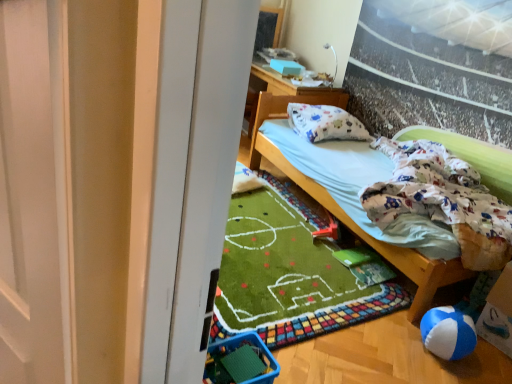
Find the location of a particular element. This screenshot has width=512, height=384. blue sponge ball at lower right is located at coordinates (448, 333).

This screenshot has height=384, width=512. Find the location of `blue plastic baby carriage at lower left`. blue plastic baby carriage at lower left is located at coordinates (240, 361).

Measure the distance between point (238, 349) and camera.

Point (238, 349) is 1.62 meters away from camera.

The width and height of the screenshot is (512, 384). Describe the element at coordinates (325, 123) in the screenshot. I see `white cotton pillow at upper center` at that location.

The height and width of the screenshot is (384, 512). What do you see at coordinates (328, 230) in the screenshot?
I see `red plastic toy at lower center` at bounding box center [328, 230].

Identify the location of white fabric pillow at upper center. The height and width of the screenshot is (384, 512). [286, 96].

Consider the image. Would you consider blue sponge ball at lower right to be distant from blue plastic baby carriage at lower left?

No, blue sponge ball at lower right is not far from blue plastic baby carriage at lower left.

Which is behind, blue sponge ball at lower right or blue plastic baby carriage at lower left?

blue sponge ball at lower right is more distant.

Considering the sizes of objects blue sponge ball at lower right and blue plastic baby carriage at lower left in the image provided, who is wider, blue sponge ball at lower right or blue plastic baby carriage at lower left?

With larger width is blue plastic baby carriage at lower left.

Does blue plastic baby carriage at lower left have a greater height compared to white cotton pillow at upper center?

No.

Image resolution: width=512 pixels, height=384 pixels. Identify the location of baby carriage that is in front of the white cotton pillow at upper center. (240, 361).

Who is smaller, blue plastic baby carriage at lower left or white cotton pillow at upper center?

blue plastic baby carriage at lower left.

How distant is white cotton pillow at upper center from blue plastic baby carriage at lower left?

The distance of white cotton pillow at upper center from blue plastic baby carriage at lower left is 6.08 feet.

Is white cotton pillow at upper center turned away from blue plastic baby carriage at lower left?

white cotton pillow at upper center is not turned away from blue plastic baby carriage at lower left.

Is white cotton pillow at upper center behind blue plastic baby carriage at lower left?

Yes, the depth of white cotton pillow at upper center is greater than that of blue plastic baby carriage at lower left.

Is white cotton pillow at upper center to the left or to the right of blue plastic baby carriage at lower left in the image?

Clearly, white cotton pillow at upper center is on the right of blue plastic baby carriage at lower left in the image.

From a real-world perspective, is white fabric pillow at upper center on top of blue sponge ball at lower right?

Yes, from a real-world perspective, white fabric pillow at upper center is over blue sponge ball at lower right

Is white fabric pillow at upper center not within blue sponge ball at lower right?

Yes, white fabric pillow at upper center is outside of blue sponge ball at lower right.

Between white fabric pillow at upper center and blue sponge ball at lower right, which one has more height?

white fabric pillow at upper center.

Considering the positions of objects white fabric pillow at upper center and blue sponge ball at lower right in the image provided, who is more to the left, white fabric pillow at upper center or blue sponge ball at lower right?

white fabric pillow at upper center.

Are blue sponge ball at lower right and white fabric pillow at upper center located far from each other?

Indeed, blue sponge ball at lower right is not near white fabric pillow at upper center.

From the image's perspective, is blue sponge ball at lower right on top of white fabric pillow at upper center?

No, from the image's perspective, blue sponge ball at lower right is not on top of white fabric pillow at upper center.

Does white cotton mattress at center have a greater height compared to blue sponge ball at lower right?

Correct, white cotton mattress at center is much taller as blue sponge ball at lower right.

Considering the positions of points (298, 149) and (432, 326), is point (298, 149) farther from camera compared to point (432, 326)?

Yes, point (298, 149) is farther from viewer.

Is white cotton mattress at center to the left of blue sponge ball at lower right from the viewer's perspective?

No.

Can you confirm if white cotton mattress at center is smaller than blue sponge ball at lower right?

No.

From the image's perspective, which object appears higher, white fabric pillow at upper center or red plastic toy at lower center?

white fabric pillow at upper center appears higher in the image.

Locate an element on the screen. This screenshot has width=512, height=384. toy on the right of white fabric pillow at upper center is located at coordinates (328, 230).

Can you confirm if white fabric pillow at upper center is thinner than red plastic toy at lower center?

No, white fabric pillow at upper center is not thinner than red plastic toy at lower center.

Considering the relative sizes of white fabric pillow at upper center and red plastic toy at lower center in the image provided, is white fabric pillow at upper center taller than red plastic toy at lower center?

Yes, white fabric pillow at upper center is taller than red plastic toy at lower center.

Find the location of a particular element. This screenshot has height=384, width=512. baby carriage located below the blue sponge ball at lower right (from the image's perspective) is located at coordinates (240, 361).

This screenshot has height=384, width=512. I want to click on pillow above the blue plastic baby carriage at lower left (from a real-world perspective), so click(x=325, y=123).

Considering their positions, is blue plastic baby carriage at lower left positioned further to white cotton pillow at upper center than white fabric pillow at upper center?

blue plastic baby carriage at lower left is positioned further to the anchor white cotton pillow at upper center.

Considering their positions, is white cotton mattress at center positioned further to white cotton pillow at upper center than red plastic toy at lower center?

red plastic toy at lower center.

Estimate the real-world distances between objects in this image. Which object is further from white fabric pillow at upper center, white cotton mattress at center or red plastic toy at lower center?

red plastic toy at lower center.

Based on their spatial positions, is red plastic toy at lower center or white fabric pillow at upper center closer to blue sponge ball at lower right?

Based on the image, red plastic toy at lower center appears to be nearer to blue sponge ball at lower right.

Looking at the image, which one is located further to white cotton pillow at upper center, blue plastic baby carriage at lower left or blue sponge ball at lower right?

blue plastic baby carriage at lower left is further to white cotton pillow at upper center.

Based on their spatial positions, is blue sponge ball at lower right or white fabric pillow at upper center further from blue plastic baby carriage at lower left?

white fabric pillow at upper center lies further to blue plastic baby carriage at lower left than the other object.

Looking at the image, which one is located further to white cotton pillow at upper center, blue sponge ball at lower right or white cotton mattress at center?

blue sponge ball at lower right is further to white cotton pillow at upper center.

Looking at the image, which one is located closer to blue sponge ball at lower right, white cotton pillow at upper center or white fabric pillow at upper center?

Among the two, white cotton pillow at upper center is located nearer to blue sponge ball at lower right.

In order to click on toy located between blue sponge ball at lower right and white fabric pillow at upper center in the depth direction in this screenshot , I will do `click(328, 230)`.

Locate an element on the screen. The image size is (512, 384). mattress between blue plastic baby carriage at lower left and white cotton pillow at upper center along the z-axis is located at coordinates (359, 187).

This screenshot has height=384, width=512. What are the coordinates of `ball located between white cotton mattress at center and white fabric pillow at upper center in the depth direction` in the screenshot? It's located at (448, 333).

Locate an element on the screen. toy between blue plastic baby carriage at lower left and white fabric pillow at upper center from front to back is located at coordinates (328, 230).